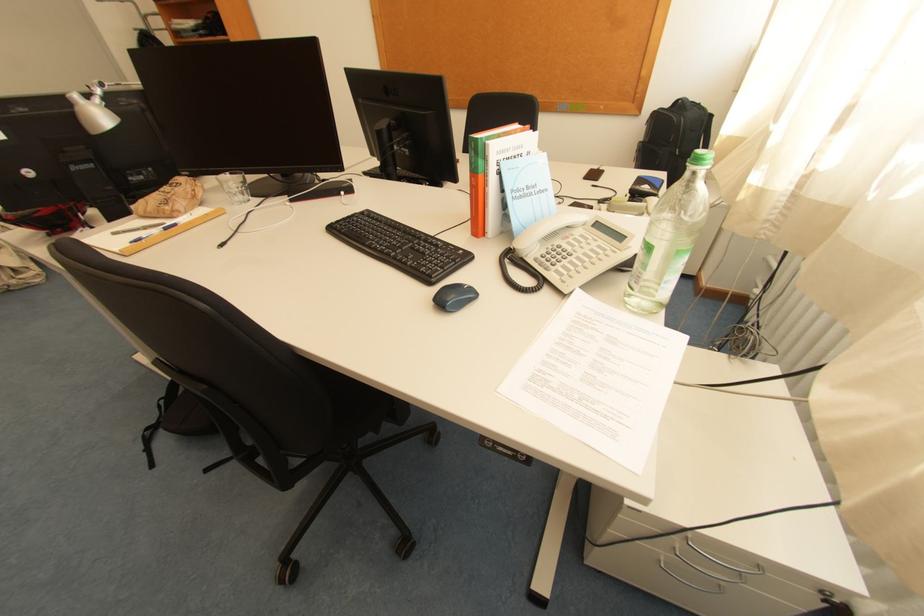
The location [157,233] corresponds to which object?

It corresponds to the blue pen in the image.